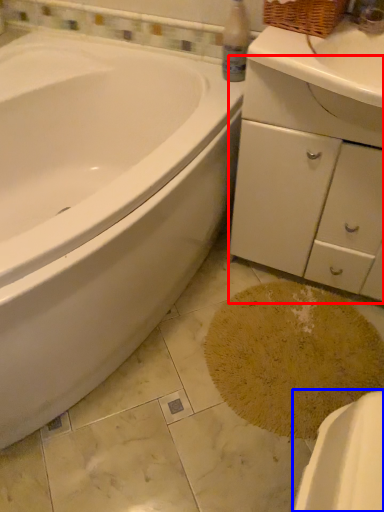
Question: Which of the following is the closest to the observer, dresser (highlighted by a red box) or porcelain (highlighted by a blue box)?

Choices:
 (A) dresser
 (B) porcelain

Answer: (B)